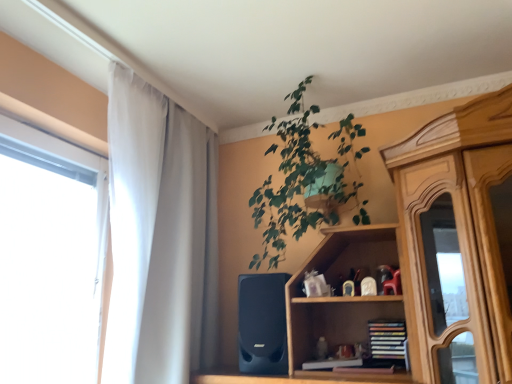
What is the approximate height of black matte speaker at lower center?

black matte speaker at lower center is 14.28 inches in height.

Where is `white sheer curtain at left`? Image resolution: width=512 pixels, height=384 pixels. white sheer curtain at left is located at coordinates [x=159, y=237].

Find the location of a particular element. This screenshot has height=384, width=512. green leafy plant at upper center is located at coordinates (303, 179).

Is white sheer curtain at left not within green leafy plant at upper center?

Yes, white sheer curtain at left is not within green leafy plant at upper center.

In the image, is white sheer curtain at left on the left side or the right side of green leafy plant at upper center?

Based on their positions, white sheer curtain at left is located to the left of green leafy plant at upper center.

Which object is thinner, white sheer curtain at left or green leafy plant at upper center?

white sheer curtain at left is thinner.

From the image's perspective, which one is positioned lower, black matte speaker at lower center or white sheer curtain at left?

black matte speaker at lower center is shown below in the image.

Is black matte speaker at lower center facing towards white sheer curtain at left?

No, black matte speaker at lower center is not aimed at white sheer curtain at left.

What's the angular difference between black matte speaker at lower center and white sheer curtain at left's facing directions?

The angular difference between black matte speaker at lower center and white sheer curtain at left is 82.7 degrees.

Measure the distance between black matte speaker at lower center and white sheer curtain at left.

black matte speaker at lower center is 16.42 inches from white sheer curtain at left.

Does green leafy plant at upper center appear on the left side of hardcover books at center?

Indeed, green leafy plant at upper center is positioned on the left side of hardcover books at center.

Considering the positions of objects green leafy plant at upper center and hardcover books at center in the image provided, who is behind, green leafy plant at upper center or hardcover books at center?

hardcover books at center.

Who is shorter, green leafy plant at upper center or hardcover books at center?

hardcover books at center is shorter.

From the picture: Does hardcover books at center have a larger size compared to green leafy plant at upper center?

Actually, hardcover books at center might be smaller than green leafy plant at upper center.

Is hardcover books at center aimed at green leafy plant at upper center?

No, hardcover books at center is not facing towards green leafy plant at upper center.

Is hardcover books at center touching green leafy plant at upper center?

No, hardcover books at center is not with green leafy plant at upper center.

Find the location of a particular element. This screenshot has width=512, height=384. book that is below the green leafy plant at upper center (from the image's perspective) is located at coordinates (387, 339).

From the image's perspective, which one is positioned lower, white sheer curtain at left or hardcover books at center?

hardcover books at center.

From the picture: Is white sheer curtain at left aimed at hardcover books at center?

Yes, white sheer curtain at left is aimed at hardcover books at center.

Is white sheer curtain at left smaller than hardcover books at center?

Actually, white sheer curtain at left might be larger than hardcover books at center.

Is white sheer curtain at left in contact with hardcover books at center?

No.

Is the position of black matte speaker at lower center less distant than that of green leafy plant at upper center?

No, black matte speaker at lower center is further to the viewer.

Considering the relative positions of black matte speaker at lower center and green leafy plant at upper center in the image provided, is black matte speaker at lower center to the left or to the right of green leafy plant at upper center?

black matte speaker at lower center is positioned on green leafy plant at upper center's left side.

Consider the image. From a real-world perspective, is black matte speaker at lower center above or below green leafy plant at upper center?

From a real-world perspective, black matte speaker at lower center is physically below green leafy plant at upper center.

Can you confirm if black matte speaker at lower center is wider than green leafy plant at upper center?

No, black matte speaker at lower center is not wider than green leafy plant at upper center.

How different are the orientations of green leafy plant at upper center and white sheer curtain at left in degrees?

The angle between the facing direction of green leafy plant at upper center and the facing direction of white sheer curtain at left is 90 degrees.

Are green leafy plant at upper center and white sheer curtain at left located far from each other?

green leafy plant at upper center is actually quite close to white sheer curtain at left.

Is the depth of green leafy plant at upper center greater than that of white sheer curtain at left?

Yes, green leafy plant at upper center is behind white sheer curtain at left.

Is point (310, 113) positioned before point (149, 107)?

No, (310, 113) is behind (149, 107).

At what (x,y) coordinates should I click in order to perform the action: click on houseplant located above the white sheer curtain at left (from a real-world perspective). Please return your answer as a coordinate pair (x, y). The image size is (512, 384). Looking at the image, I should click on tap(303, 179).

You are a GUI agent. You are given a task and a screenshot of the screen. Output one action in this format:
    pyautogui.click(x=<x>, y=<y>)
    Task: Click on the curtain on the left of black matte speaker at lower center
    
    Given the screenshot: What is the action you would take?
    pyautogui.click(x=159, y=237)

Estimate the real-world distances between objects in this image. Which object is further from hardcover books at center, white sheer curtain at left or black matte speaker at lower center?

white sheer curtain at left lies further to hardcover books at center than the other object.

Estimate the real-world distances between objects in this image. Which object is further from white sheer curtain at left, green leafy plant at upper center or black matte speaker at lower center?

The object further to white sheer curtain at left is green leafy plant at upper center.

Based on their spatial positions, is hardcover books at center or black matte speaker at lower center closer to green leafy plant at upper center?

Among the two, black matte speaker at lower center is located nearer to green leafy plant at upper center.

Based on their spatial positions, is white sheer curtain at left or green leafy plant at upper center closer to black matte speaker at lower center?

Among the two, white sheer curtain at left is located nearer to black matte speaker at lower center.

Which object lies further to the anchor point black matte speaker at lower center, green leafy plant at upper center or hardcover books at center?

green leafy plant at upper center is positioned further to the anchor black matte speaker at lower center.

Based on their spatial positions, is green leafy plant at upper center or white sheer curtain at left further from black matte speaker at lower center?

green leafy plant at upper center is further to black matte speaker at lower center.

Based on their spatial positions, is green leafy plant at upper center or hardcover books at center closer to white sheer curtain at left?

Among the two, green leafy plant at upper center is located nearer to white sheer curtain at left.

Which object lies further to the anchor point black matte speaker at lower center, hardcover books at center or green leafy plant at upper center?

green leafy plant at upper center lies further to black matte speaker at lower center than the other object.

Find the location of a particular element. The image size is (512, 384). speaker between white sheer curtain at left and green leafy plant at upper center from left to right is located at coordinates (262, 324).

Identify the location of speaker located between white sheer curtain at left and hardcover books at center in the left-right direction. 262,324.

Find the location of a particular element. This screenshot has height=384, width=512. houseplant located between white sheer curtain at left and hardcover books at center in the left-right direction is located at coordinates (303, 179).

Find the location of a particular element. The height and width of the screenshot is (384, 512). speaker that lies between green leafy plant at upper center and hardcover books at center from top to bottom is located at coordinates (262, 324).